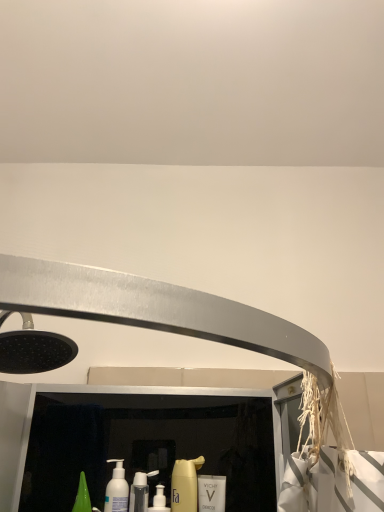
Question: Considering the positions of white glossy mouthwash at center, which ranks as the 1th mouthwash in right-to-left order, and white matte bottle at lower left, positioned as the second mouthwash in right-to-left order, in the image, is white glossy mouthwash at center, which ranks as the 1th mouthwash in right-to-left order, taller or shorter than white matte bottle at lower left, positioned as the second mouthwash in right-to-left order,?

Choices:
 (A) short
 (B) tall

Answer: (A)

Question: Is point (201, 497) positioned closer to the camera than point (117, 471)?

Choices:
 (A) farther
 (B) closer

Answer: (B)

Question: Based on their relative distances, which object is farther from the white matte bottle at lower left, the 1th mouthwash from the left?

Choices:
 (A) white glossy mouthwash at center, which ranks as the 1th mouthwash in right-to-left order
 (B) yellow matte bottle at center, which ranks as the first cleaning product in right-to-left order
 (C) white glossy bottle at center, positioned as the second cleaning product in right-to-left order

Answer: (A)

Question: Considering the real-world distances, which object is closest to the white matte bottle at lower left, the 1th mouthwash from the left?

Choices:
 (A) white glossy mouthwash at center, which is the second mouthwash in left-to-right order
 (B) white glossy bottle at center, which is counted as the 1th cleaning product, starting from the left
 (C) yellow matte bottle at center, which ranks as the second cleaning product in left-to-right order

Answer: (B)